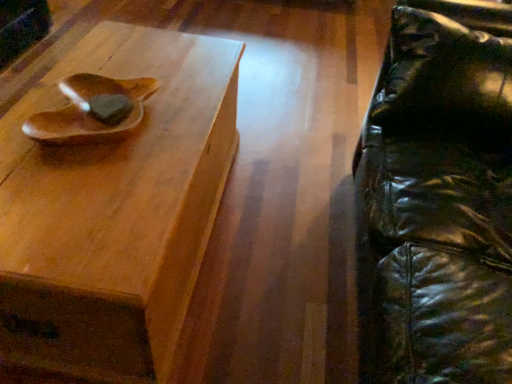
You are a GUI agent. You are given a task and a screenshot of the screen. Output one action in this format:
    pyautogui.click(x=<x>, y=<y>)
    Task: Click on the free point to the right of wooden tray at upper left
    
    Given the screenshot: What is the action you would take?
    pyautogui.click(x=271, y=234)